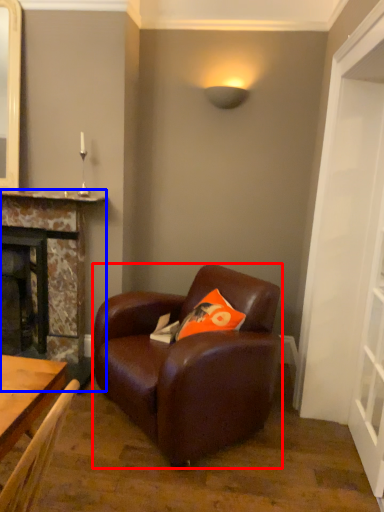
Question: Which point is further to the camera, chair (highlighted by a red box) or fireplace (highlighted by a blue box)?

Choices:
 (A) chair
 (B) fireplace

Answer: (B)